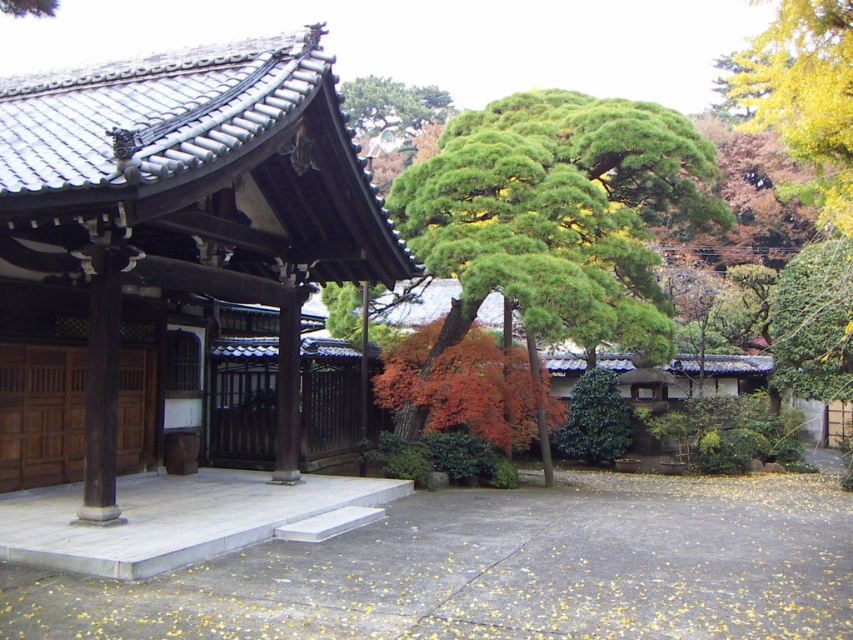
Question: Is yellow/golden/yellowish-green leafy tree at upper right bigger than green textured tree at upper center?

Choices:
 (A) no
 (B) yes

Answer: (B)

Question: Which of the following is the farthest from the observer?

Choices:
 (A) green textured tree at upper center
 (B) yellow/golden/yellowish-green leafy tree at upper right

Answer: (A)

Question: Considering the relative positions of green needle-like at center and yellow/golden/yellowish-green leafy tree at upper right in the image provided, where is green needle-like at center located with respect to yellow/golden/yellowish-green leafy tree at upper right?

Choices:
 (A) right
 (B) left

Answer: (B)

Question: Which point is farther from the camera taking this photo?

Choices:
 (A) (409, 401)
 (B) (370, 93)
 (C) (753, 49)

Answer: (B)

Question: Does yellow/golden/yellowish-green leafy tree at upper right appear on the left side of green textured tree at upper center?

Choices:
 (A) no
 (B) yes

Answer: (A)

Question: Considering the real-world distances, which object is closest to the yellow/golden/yellowish-green leafy tree at upper right?

Choices:
 (A) green textured tree at upper center
 (B) green needle-like at center

Answer: (B)